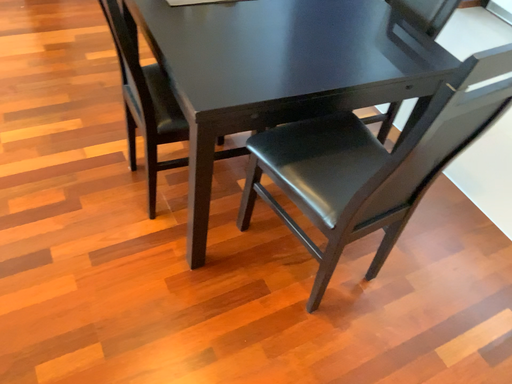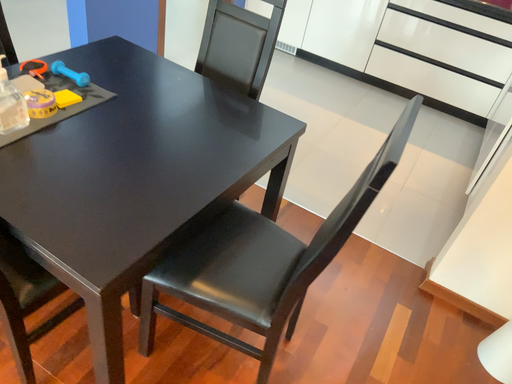
Question: Which way did the camera rotate in the video?

Choices:
 (A) rotated left
 (B) rotated right

Answer: (B)